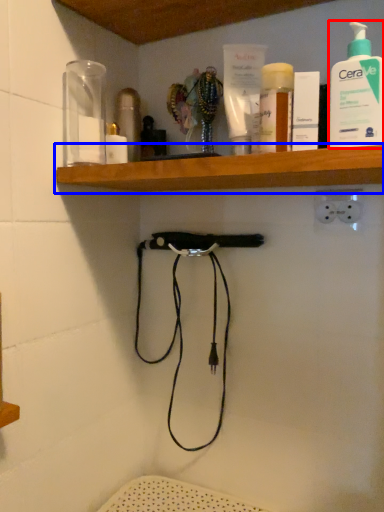
Question: Which point is further to the camera, cleaning product (highlighted by a red box) or shelf (highlighted by a blue box)?

Choices:
 (A) cleaning product
 (B) shelf

Answer: (A)